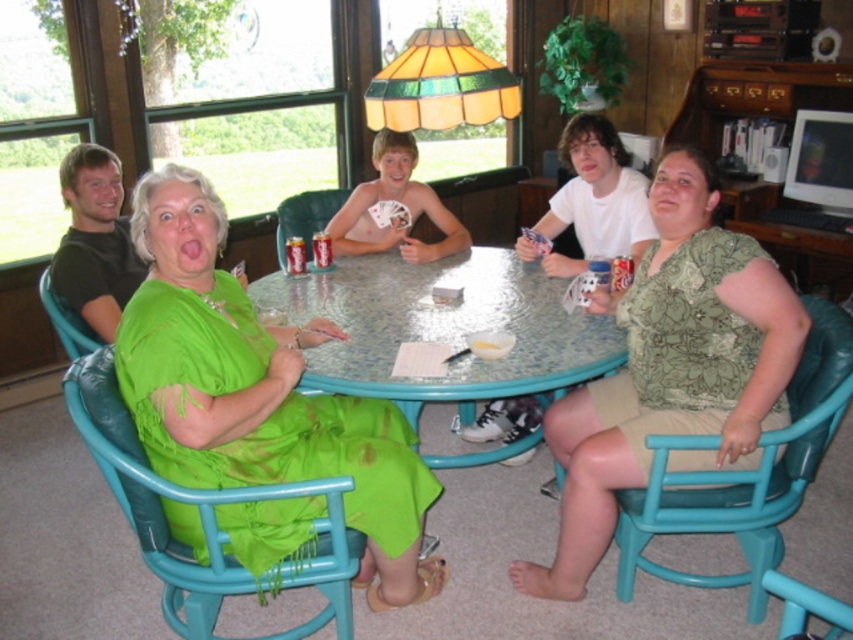
Consider the image. Is the position of green satin dress at center more distant than that of clear glass table at center?

No.

From the picture: Is green satin dress at center smaller than clear glass table at center?

Yes.

Is point (242, 465) closer to viewer compared to point (306, 380)?

That is True.

At what (x,y) coordinates should I click in order to perform the action: click on green satin dress at center. Please return your answer as a coordinate pair (x, y). Looking at the image, I should click on (257, 392).

Does green satin dress at center appear on the left side of green fabric chair at left?

In fact, green satin dress at center is to the right of green fabric chair at left.

Does point (398, 442) lie behind point (91, 340)?

That is False.

This screenshot has width=853, height=640. Describe the element at coordinates (257, 392) in the screenshot. I see `green satin dress at center` at that location.

This screenshot has width=853, height=640. Find the location of `green satin dress at center`. green satin dress at center is located at coordinates (257, 392).

Does green floral blouse at center appear on the left side of clear glass table at center?

No, green floral blouse at center is not to the left of clear glass table at center.

Does green floral blouse at center lie behind clear glass table at center?

No, it is not.

At what (x,y) coordinates should I click in order to perform the action: click on green floral blouse at center. Please return your answer as a coordinate pair (x, y). This screenshot has width=853, height=640. Looking at the image, I should click on (671, 369).

Identify the location of green floral blouse at center. The height and width of the screenshot is (640, 853). (671, 369).